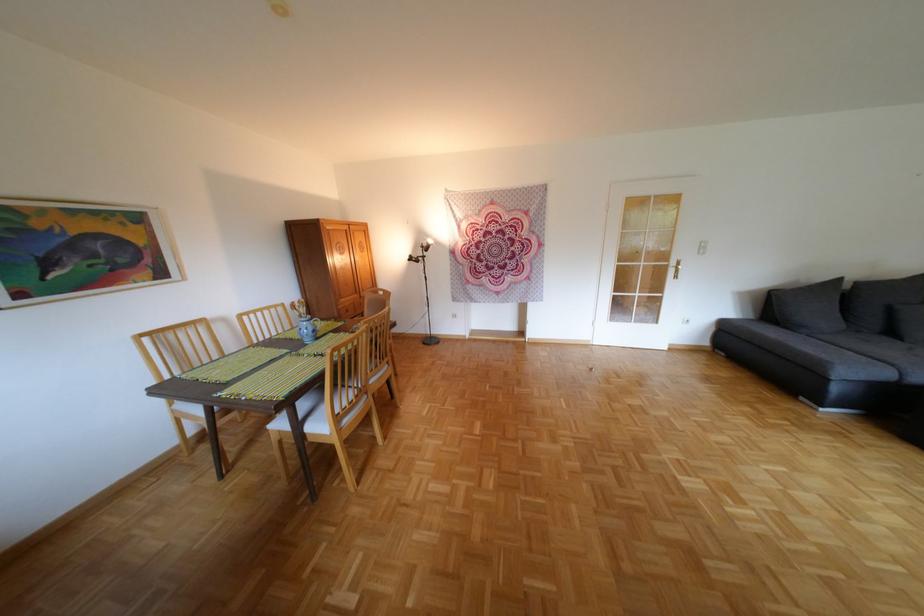
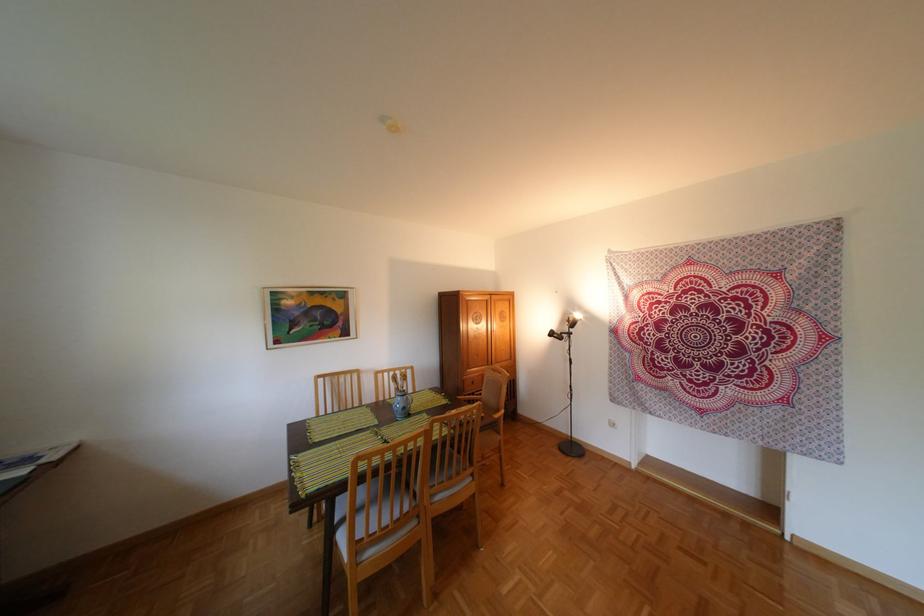
Question: The camera is either moving clockwise (left) or counter-clockwise (right) around the object. The first image is from the beginning of the video and the second image is from the end. Is the camera moving left or right when shooting the video?

Choices:
 (A) Left
 (B) Right

Answer: (B)